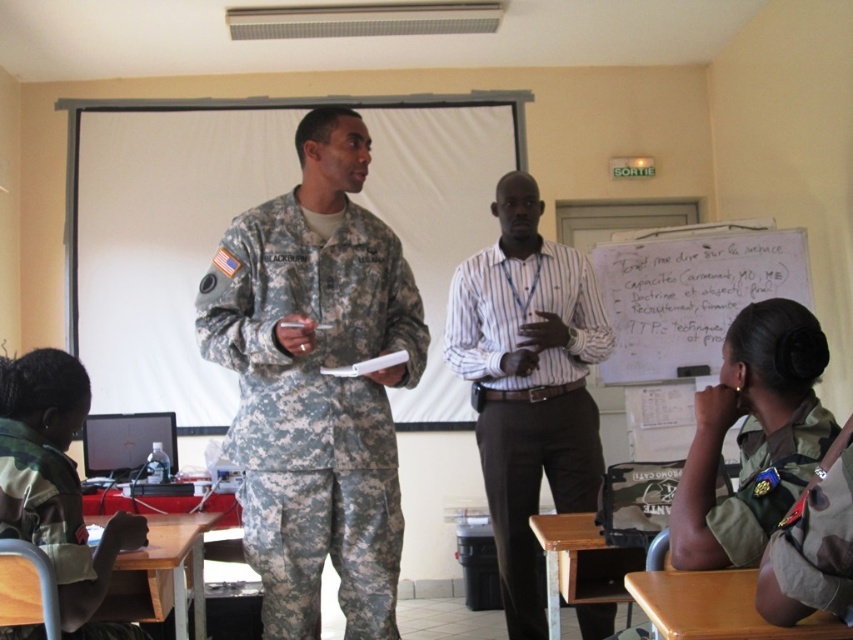
You are a student sitting in the classroom and need to walk from the striped cotton shirt at center to the whiteboard at right to write something. How many steps would you need to take if each step covers 28 inches?

The distance between the striped cotton shirt at center and the whiteboard at right is 35.68 inches. Since each step covers 28 inches, you would need to take 2 steps to cover the distance.